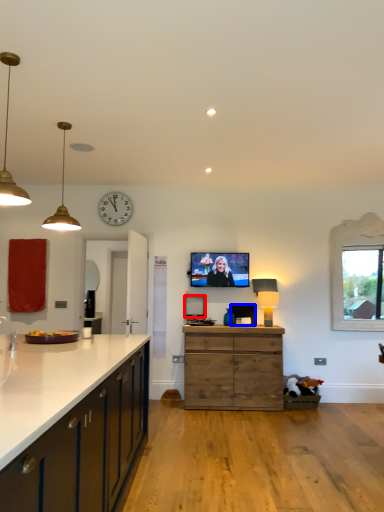
Question: Which of the following is the farthest to the observer, picture frame (highlighted by a red box) or picture frame (highlighted by a blue box)?

Choices:
 (A) picture frame
 (B) picture frame

Answer: (A)